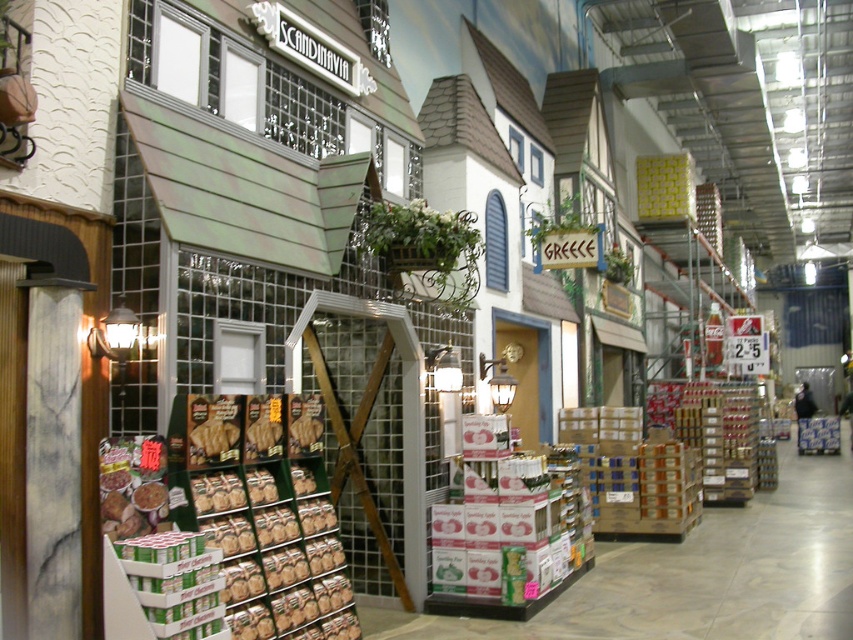
You are a grocery store employee who needs to place a new item on the shelf. You have a large package that is 2 meters wide. The shelf where you want to place it is between the green cardboard boxes at center and the brown matte cookies at center. Is there enough space for the package?

The green cardboard boxes at center is bigger than brown matte cookies at center. However, the total space between them isn